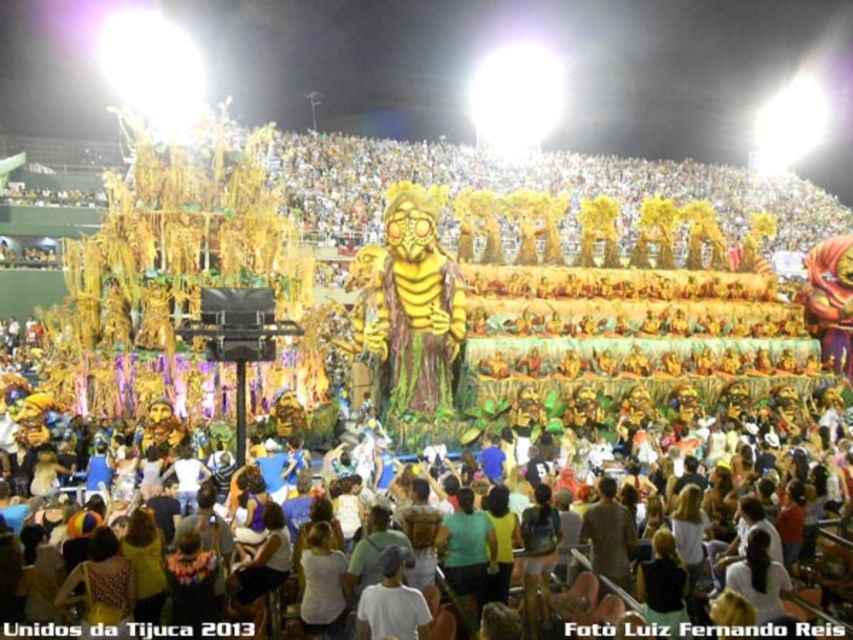
You are a photographer at the carnival parade. You want to capture a photo that includes both the multicolored carnival costumes at center and the gold metallic mask at center. Which object should you focus on to ensure both are in frame without zooming in or out?

The multicolored carnival costumes at center are wider than the gold metallic mask at center. To include both in the frame without zooming, focus on the center where both are positioned, ensuring the wider multicolored carnival costumes are fully captured while the mask remains in view.

You are a photographer at the Tijuca Carnival in 2013, and you want to capture a photo of the multicolored carnival costumes at center. According to the scene description, where should you position yourself to ensure the costumes are in the frame?

The multicolored carnival costumes at center are located at point (486, 560), so you should position yourself facing that coordinate to ensure they are in the frame.